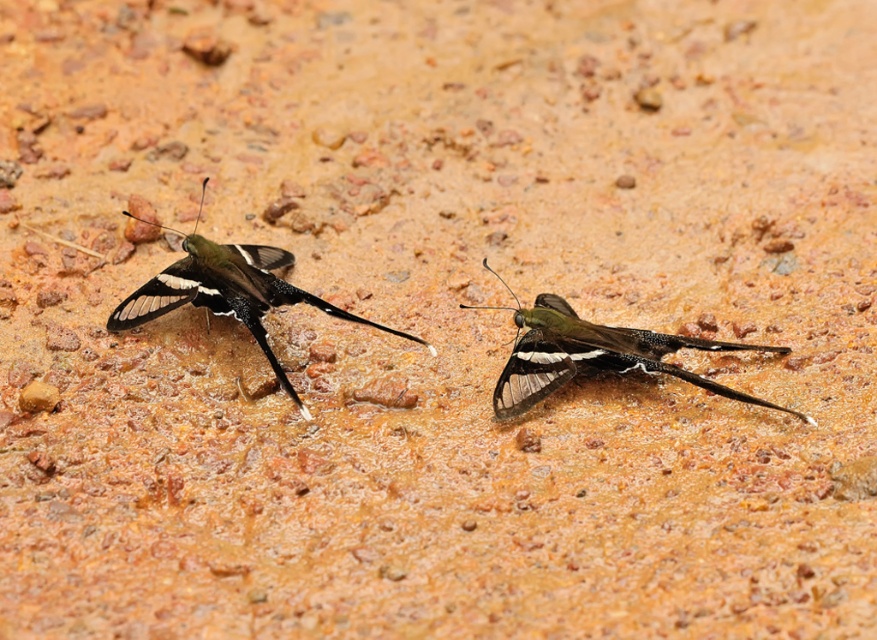
You are an entomologist observing two butterflies in a natural setting. You notice a shiny green butterfly at center and a matte black butterfly at left. Which butterfly is positioned to the right of the other?

The shiny green butterfly at center is positioned to the right of the matte black butterfly at left.

You are an entomologist observing two butterflies on a wet soil surface. You notice a point at coordinates (593, 355). Which butterfly is located at this point?

The point at coordinates (593, 355) corresponds to the shiny green butterfly at center.